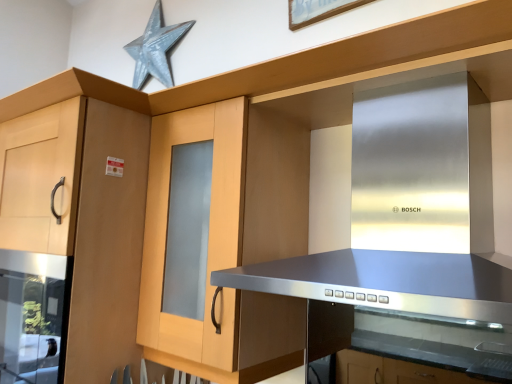
Question: Should I look upward or downward to see stainless steel vent at center?

Choices:
 (A) down
 (B) up

Answer: (A)

Question: Are stainless steel vent at center and light wood cabinet at left making contact?

Choices:
 (A) no
 (B) yes

Answer: (A)

Question: Is stainless steel vent at center not near light wood cabinet at left?

Choices:
 (A) yes
 (B) no

Answer: (B)

Question: Can you confirm if stainless steel vent at center is positioned to the right of light wood cabinet at left?

Choices:
 (A) yes
 (B) no

Answer: (A)

Question: Is stainless steel vent at center shorter than light wood cabinet at left?

Choices:
 (A) no
 (B) yes

Answer: (B)

Question: Is stainless steel vent at center at the left side of light wood cabinet at left?

Choices:
 (A) yes
 (B) no

Answer: (B)

Question: Can we say stainless steel vent at center lies outside light wood cabinet at left?

Choices:
 (A) yes
 (B) no

Answer: (A)

Question: Does light wood cabinet at left turn towards metallic silver star at upper center?

Choices:
 (A) yes
 (B) no

Answer: (B)

Question: Would you say light wood cabinet at left is a long distance from metallic silver star at upper center?

Choices:
 (A) yes
 (B) no

Answer: (B)

Question: Can you confirm if light wood cabinet at left is shorter than metallic silver star at upper center?

Choices:
 (A) yes
 (B) no

Answer: (B)

Question: Is the surface of light wood cabinet at left in direct contact with metallic silver star at upper center?

Choices:
 (A) yes
 (B) no

Answer: (B)

Question: Is light wood cabinet at left taller than metallic silver star at upper center?

Choices:
 (A) yes
 (B) no

Answer: (A)

Question: Is metallic silver star at upper center at the back of light wood cabinet at left?

Choices:
 (A) no
 (B) yes

Answer: (A)

Question: From the image's perspective, is metallic silver star at upper center over light wood cabinet at left?

Choices:
 (A) yes
 (B) no

Answer: (A)